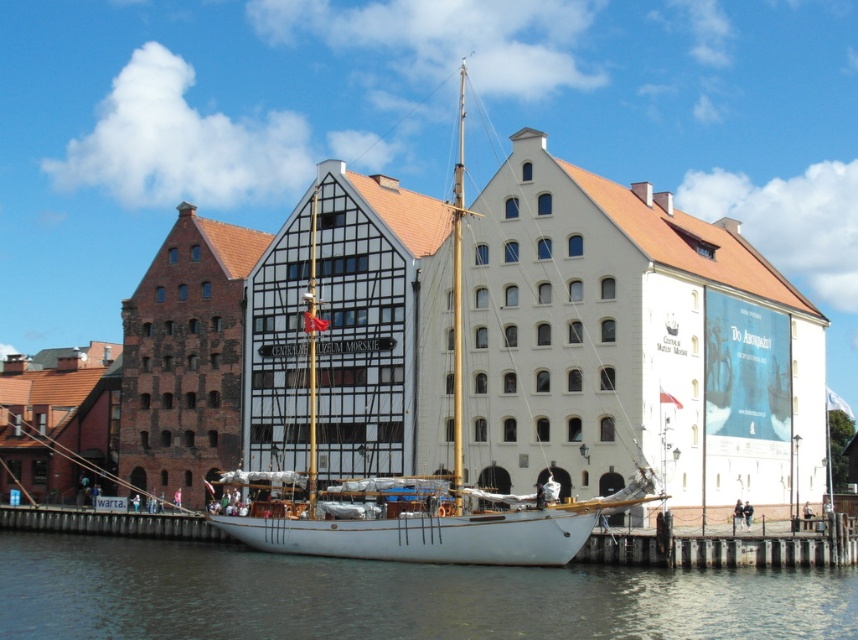
You are standing on the wooden dock at lower center and want to see the transparent water at lower center. In which direction should you look relative to the dock?

You should look upward because the transparent water at lower center is located above the wooden dock at lower center.

You are standing at the pier and want to reach the point marked as point (92, 616). The banner on the building is blocking your direct path. Given that the banner is 10 feet wide and 15 feet tall, can you walk around it to reach the point without going further than 150 feet from your current position?

The point (92, 616) is 148.98 feet away from the viewer. Since the maximum allowed distance is 150 feet, you can walk around the banner and reach the point without exceeding the distance limit.